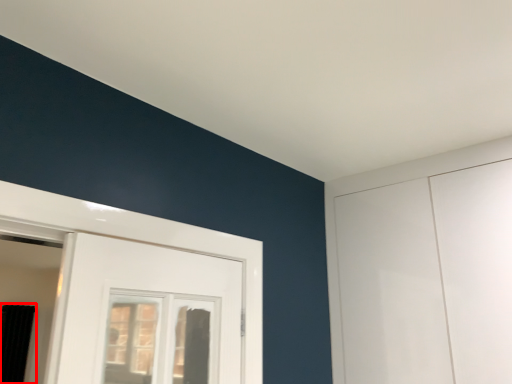
Question: Considering the relative positions of curtain (annotated by the red box) and window in the image provided, where is curtain (annotated by the red box) located with respect to the staircase?

Choices:
 (A) left
 (B) right

Answer: (A)